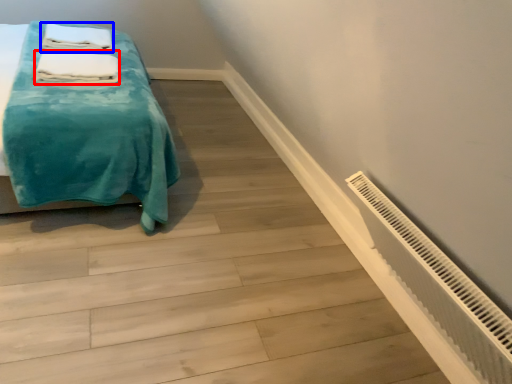
Question: Which object appears closest to the camera in this image, bath towel (highlighted by a red box) or bath towel (highlighted by a blue box)?

Choices:
 (A) bath towel
 (B) bath towel

Answer: (A)